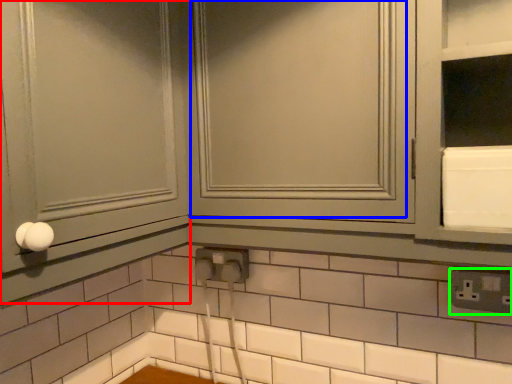
Question: Based on their relative distances, which object is nearer to screen door (highlighted by a red box)? Choose from window (highlighted by a blue box) and electric outlet (highlighted by a green box).

Choices:
 (A) window
 (B) electric outlet

Answer: (A)